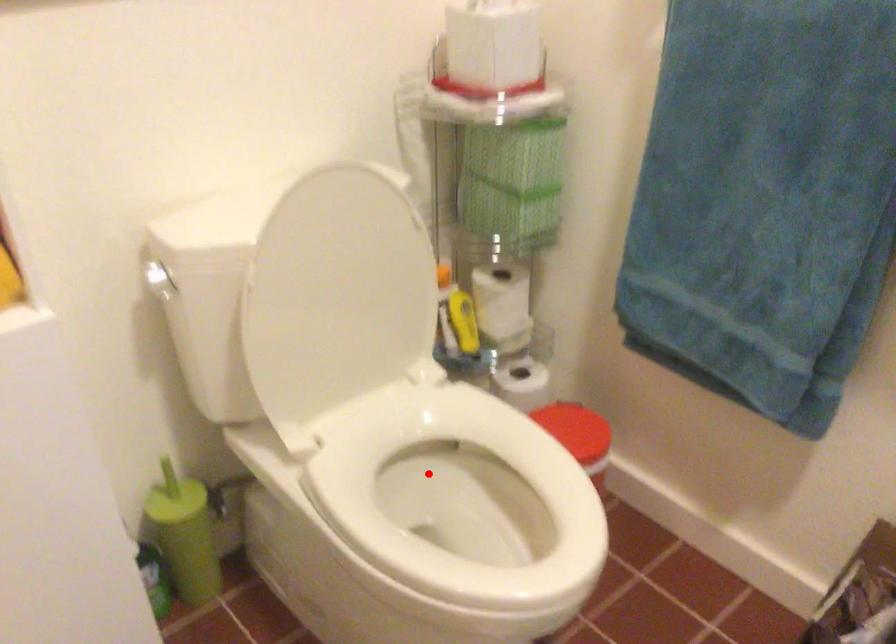
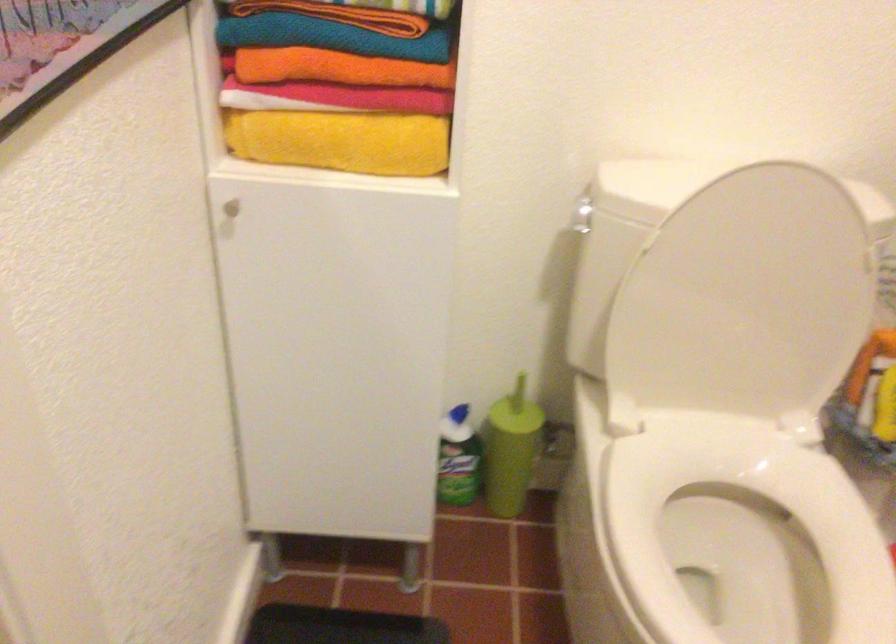
Question: I am providing you with two images of the same scene from different viewpoints. A red point is shown in image1. For the corresponding object point in image2, is it positioned nearer or farther from the camera?

Choices:
 (A) Nearer
 (B) Farther

Answer: (A)